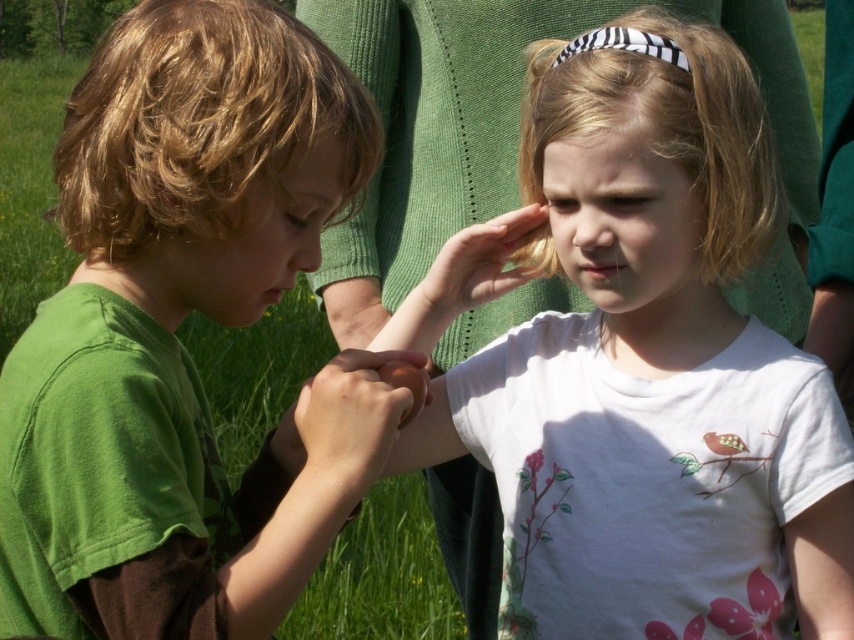
Which is behind, point (75, 284) or point (623, 150)?

Positioned behind is point (623, 150).

Does point (309, 77) come in front of point (607, 161)?

Yes, it is in front of point (607, 161).

Is point (382, 444) positioned behind point (653, 157)?

No, it is not.

At what (x,y) coordinates should I click in order to perform the action: click on green matte shirt at center. Please return your answer as a coordinate pair (x, y). This screenshot has width=854, height=640. Looking at the image, I should click on (178, 340).

Locate an element on the screen. The image size is (854, 640). matte green shirt at center is located at coordinates (256, 237).

Can you confirm if matte green shirt at center is bigger than matte green nose at center?

Yes.

Is point (203, 260) less distant than point (294, 264)?

That is True.

The image size is (854, 640). In order to click on matte green shirt at center in this screenshot , I will do `click(256, 237)`.

Who is positioned more to the right, white matte face at center or matte green nose at center?

From the viewer's perspective, white matte face at center appears more on the right side.

Describe the element at coordinates (624, 225) in the screenshot. I see `white matte face at center` at that location.

The image size is (854, 640). I want to click on white matte face at center, so click(x=624, y=225).